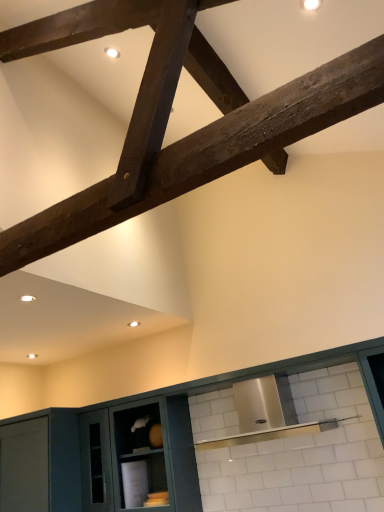
What do you see at coordinates (139, 440) in the screenshot? I see `matte green cabinetry at center` at bounding box center [139, 440].

Where is `matte green cabinetry at center`? This screenshot has width=384, height=512. matte green cabinetry at center is located at coordinates (139, 440).

The width and height of the screenshot is (384, 512). Describe the element at coordinates (211, 152) in the screenshot. I see `dark brown wood beam at upper center` at that location.

Image resolution: width=384 pixels, height=512 pixels. In order to click on dark brown wood beam at upper center in this screenshot , I will do `click(211, 152)`.

Locate an element on the screen. The image size is (384, 512). matte green cabinetry at center is located at coordinates (139, 440).

Considering the relative positions of dark brown wood beam at upper center and matte green cabinetry at center in the image provided, is dark brown wood beam at upper center to the left of matte green cabinetry at center from the viewer's perspective?

Yes.

Is dark brown wood beam at upper center behind matte green cabinetry at center?

No, the depth of dark brown wood beam at upper center is less than that of matte green cabinetry at center.

Is point (190, 170) positioned before point (225, 385)?

That is True.

From the image's perspective, which object appears higher, dark brown wood beam at upper center or matte green cabinetry at center?

dark brown wood beam at upper center.

From a real-world perspective, is dark brown wood beam at upper center on matte green cabinetry at center?

Yes, from a real-world perspective, dark brown wood beam at upper center is over matte green cabinetry at center

Is dark brown wood beam at upper center wider than matte green cabinetry at center?

Yes.

Is dark brown wood beam at upper center taller than matte green cabinetry at center?

No.

Is dark brown wood beam at upper center bigger or smaller than matte green cabinetry at center?

In the image, dark brown wood beam at upper center appears to be smaller than matte green cabinetry at center.

Is matte green cabinetry at center completely or partially inside dark brown wood beam at upper center?

No, matte green cabinetry at center is not surrounded by dark brown wood beam at upper center.

Can you see dark brown wood beam at upper center touching matte green cabinetry at center?

No, dark brown wood beam at upper center is not making contact with matte green cabinetry at center.

Is dark brown wood beam at upper center turned away from matte green cabinetry at center?

No, dark brown wood beam at upper center's orientation is not away from matte green cabinetry at center.

How different are the orientations of dark brown wood beam at upper center and matte green cabinetry at center in degrees?

90.7 degrees separate the facing orientations of dark brown wood beam at upper center and matte green cabinetry at center.

There is a matte green cabinetry at center. Where is `beam above it (from a real-world perspective)`? The width and height of the screenshot is (384, 512). beam above it (from a real-world perspective) is located at coordinates (211, 152).

Considering the relative positions of matte green cabinetry at center and dark brown wood beam at upper center in the image provided, is matte green cabinetry at center to the left of dark brown wood beam at upper center from the viewer's perspective?

In fact, matte green cabinetry at center is to the right of dark brown wood beam at upper center.

Considering the positions of objects matte green cabinetry at center and dark brown wood beam at upper center in the image provided, who is behind, matte green cabinetry at center or dark brown wood beam at upper center?

matte green cabinetry at center is further from the camera.

Is point (66, 429) farther from viewer compared to point (270, 120)?

Yes.

From the image's perspective, which one is positioned higher, matte green cabinetry at center or dark brown wood beam at upper center?

dark brown wood beam at upper center.

From a real-world perspective, is matte green cabinetry at center under dark brown wood beam at upper center?

Yes, from a real-world perspective, matte green cabinetry at center is below dark brown wood beam at upper center.

Is matte green cabinetry at center wider or thinner than dark brown wood beam at upper center?

In the image, matte green cabinetry at center appears to be more narrow than dark brown wood beam at upper center.

Can you confirm if matte green cabinetry at center is shorter than dark brown wood beam at upper center?

No, matte green cabinetry at center is not shorter than dark brown wood beam at upper center.

Can you confirm if matte green cabinetry at center is smaller than dark brown wood beam at upper center?

Actually, matte green cabinetry at center might be larger than dark brown wood beam at upper center.

Would you say matte green cabinetry at center is outside dark brown wood beam at upper center?

Yes.

Is matte green cabinetry at center with dark brown wood beam at upper center?

There is a gap between matte green cabinetry at center and dark brown wood beam at upper center.

Is matte green cabinetry at center facing away from dark brown wood beam at upper center?

No.

What's the angular difference between matte green cabinetry at center and dark brown wood beam at upper center's facing directions?

The angular difference between matte green cabinetry at center and dark brown wood beam at upper center is 90.7 degrees.

Locate an element on the screen. This screenshot has height=512, width=384. cabinetry that appears below the dark brown wood beam at upper center (from the image's perspective) is located at coordinates coord(139,440).

The height and width of the screenshot is (512, 384). Find the location of `cabinetry on the right side of dark brown wood beam at upper center`. cabinetry on the right side of dark brown wood beam at upper center is located at coordinates (139, 440).

The width and height of the screenshot is (384, 512). I want to click on beam on the left of matte green cabinetry at center, so click(211, 152).